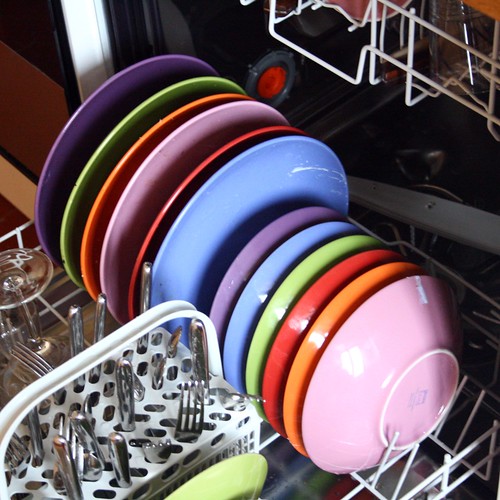
In order to click on bowls in this screenshot , I will do `click(376, 342)`, `click(325, 331)`, `click(304, 318)`, `click(285, 299)`, `click(260, 283)`, `click(245, 269)`.